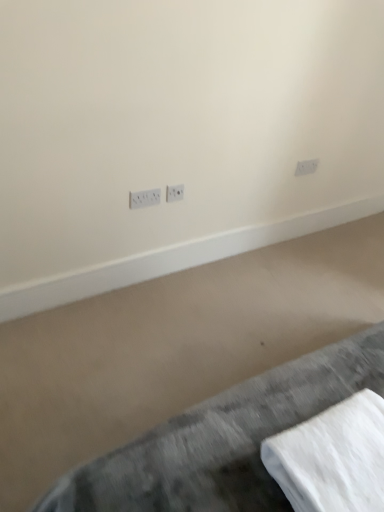
The image size is (384, 512). What do you see at coordinates (174, 193) in the screenshot?
I see `white plastic power plugs and sockets at center, which is counted as the second power plugs and sockets, starting from the back` at bounding box center [174, 193].

The image size is (384, 512). What are the coordinates of `white plastic power plugs and sockets at center, placed as the second power plugs and sockets when sorted from bottom to top` in the screenshot? It's located at (174, 193).

The height and width of the screenshot is (512, 384). What do you see at coordinates (144, 198) in the screenshot?
I see `white plastic power plugs and sockets at center, acting as the 3th power plugs and sockets starting from the top` at bounding box center [144, 198].

The height and width of the screenshot is (512, 384). Describe the element at coordinates (306, 167) in the screenshot. I see `white plastic power plugs and sockets at upper right, acting as the first power plugs and sockets starting from the back` at that location.

Where is `white plastic power plugs and sockets at center, the 2th power plugs and sockets when ordered from front to back`? Image resolution: width=384 pixels, height=512 pixels. white plastic power plugs and sockets at center, the 2th power plugs and sockets when ordered from front to back is located at coordinates (174, 193).

Which object is further away from the camera, white plastic power plugs and sockets at upper right, the third power plugs and sockets positioned from the bottom, or white plastic power plugs and sockets at center, the 2th power plugs and sockets when ordered from front to back?

white plastic power plugs and sockets at upper right, the third power plugs and sockets positioned from the bottom, is further away from the camera.

Looking at this image, is white plastic power plugs and sockets at upper right, positioned as the first power plugs and sockets in top-to-bottom order, to the right of white plastic power plugs and sockets at center, which ranks as the 2th power plugs and sockets in left-to-right order, from the viewer's perspective?

Indeed, white plastic power plugs and sockets at upper right, positioned as the first power plugs and sockets in top-to-bottom order, is positioned on the right side of white plastic power plugs and sockets at center, which ranks as the 2th power plugs and sockets in left-to-right order.

Are white plastic power plugs and sockets at upper right, the third power plugs and sockets positioned from the bottom, and white plastic power plugs and sockets at center, placed as the second power plugs and sockets when sorted from bottom to top, far apart?

No, white plastic power plugs and sockets at upper right, the third power plugs and sockets positioned from the bottom, is in close proximity to white plastic power plugs and sockets at center, placed as the second power plugs and sockets when sorted from bottom to top.

Considering the relative sizes of white plastic power plugs and sockets at upper right, which is counted as the first power plugs and sockets, starting from the right, and white plastic power plugs and sockets at center, which ranks as the 2th power plugs and sockets in left-to-right order, in the image provided, is white plastic power plugs and sockets at upper right, which is counted as the first power plugs and sockets, starting from the right, shorter than white plastic power plugs and sockets at center, which ranks as the 2th power plugs and sockets in left-to-right order,?

Yes, white plastic power plugs and sockets at upper right, which is counted as the first power plugs and sockets, starting from the right, is shorter than white plastic power plugs and sockets at center, which ranks as the 2th power plugs and sockets in left-to-right order.

In the scene shown: From a real-world perspective, relative to white cotton towel at lower right, is white plastic power plugs and sockets at center, which is counted as the 2th power plugs and sockets, starting from the top, vertically above or below?

In terms of real-world spatial position, white plastic power plugs and sockets at center, which is counted as the 2th power plugs and sockets, starting from the top, is below white cotton towel at lower right.

The width and height of the screenshot is (384, 512). Find the location of `linen below the white plastic power plugs and sockets at center, which ranks as the 2th power plugs and sockets in left-to-right order (from the image's perspective)`. linen below the white plastic power plugs and sockets at center, which ranks as the 2th power plugs and sockets in left-to-right order (from the image's perspective) is located at coordinates (332, 458).

Considering the positions of point (174, 198) and point (368, 437), is point (174, 198) closer or farther from the camera than point (368, 437)?

Point (174, 198) is positioned farther from the camera compared to point (368, 437).

From a real-world perspective, which object stands above the other?

From a 3D spatial view, white plastic power plugs and sockets at upper right, which is counted as the first power plugs and sockets, starting from the right, is above.

Consider the image. Would you say white plastic power plugs and sockets at upper right, acting as the first power plugs and sockets starting from the back, is to the left or to the right of white plastic power plugs and sockets at center, which appears as the 3th power plugs and sockets when viewed from the back, in the picture?

Clearly, white plastic power plugs and sockets at upper right, acting as the first power plugs and sockets starting from the back, is on the right of white plastic power plugs and sockets at center, which appears as the 3th power plugs and sockets when viewed from the back, in the image.

Considering the sizes of objects white plastic power plugs and sockets at upper right, which is counted as the first power plugs and sockets, starting from the right, and white plastic power plugs and sockets at center, which is the 3th power plugs and sockets in right-to-left order, in the image provided, who is taller, white plastic power plugs and sockets at upper right, which is counted as the first power plugs and sockets, starting from the right, or white plastic power plugs and sockets at center, which is the 3th power plugs and sockets in right-to-left order,?

Standing taller between the two is white plastic power plugs and sockets at center, which is the 3th power plugs and sockets in right-to-left order.

Which point is more forward, (215, 492) or (168, 194)?

The point (215, 492) is closer to the camera.

Is gray fabric bed at lower right taller than white plastic power plugs and sockets at center, the 2th power plugs and sockets when ordered from front to back?

Correct, gray fabric bed at lower right is much taller as white plastic power plugs and sockets at center, the 2th power plugs and sockets when ordered from front to back.

Is gray fabric bed at lower right not near white plastic power plugs and sockets at center, which is counted as the 2th power plugs and sockets, starting from the right?

Yes, gray fabric bed at lower right and white plastic power plugs and sockets at center, which is counted as the 2th power plugs and sockets, starting from the right, are located far from each other.

From the image's perspective, is white plastic power plugs and sockets at center, placed as the 1th power plugs and sockets when sorted from left to right, positioned above or below white plastic power plugs and sockets at upper right, positioned as the first power plugs and sockets in top-to-bottom order?

Based on their image positions, white plastic power plugs and sockets at center, placed as the 1th power plugs and sockets when sorted from left to right, is located beneath white plastic power plugs and sockets at upper right, positioned as the first power plugs and sockets in top-to-bottom order.

How different are the orientations of white plastic power plugs and sockets at center, placed as the 1th power plugs and sockets when sorted from left to right, and white plastic power plugs and sockets at upper right, positioned as the first power plugs and sockets in top-to-bottom order, in degrees?

The facing directions of white plastic power plugs and sockets at center, placed as the 1th power plugs and sockets when sorted from left to right, and white plastic power plugs and sockets at upper right, positioned as the first power plugs and sockets in top-to-bottom order, are 1.55 degrees apart.

In terms of size, does white plastic power plugs and sockets at center, marked as the 1th power plugs and sockets in a front-to-back arrangement, appear bigger or smaller than white plastic power plugs and sockets at upper right, positioned as the first power plugs and sockets in top-to-bottom order?

Clearly, white plastic power plugs and sockets at center, marked as the 1th power plugs and sockets in a front-to-back arrangement, is larger in size than white plastic power plugs and sockets at upper right, positioned as the first power plugs and sockets in top-to-bottom order.

Between white plastic power plugs and sockets at center, which appears as the 3th power plugs and sockets when viewed from the back, and white plastic power plugs and sockets at upper right, which is counted as the first power plugs and sockets, starting from the right, which one appears on the left side from the viewer's perspective?

white plastic power plugs and sockets at center, which appears as the 3th power plugs and sockets when viewed from the back.

Based on the photo, which of these two, white plastic power plugs and sockets at upper right, acting as the first power plugs and sockets starting from the back, or gray fabric bed at lower right, stands shorter?

white plastic power plugs and sockets at upper right, acting as the first power plugs and sockets starting from the back, is shorter.

Measure the distance from white plastic power plugs and sockets at upper right, the 3th power plugs and sockets from the left, to gray fabric bed at lower right.

The distance of white plastic power plugs and sockets at upper right, the 3th power plugs and sockets from the left, from gray fabric bed at lower right is 5.14 feet.

Is there a large distance between white plastic power plugs and sockets at upper right, positioned as the first power plugs and sockets in top-to-bottom order, and gray fabric bed at lower right?

Yes, white plastic power plugs and sockets at upper right, positioned as the first power plugs and sockets in top-to-bottom order, and gray fabric bed at lower right are located far from each other.

Would you say white plastic power plugs and sockets at upper right, which is counted as the first power plugs and sockets, starting from the right, is to the left or to the right of gray fabric bed at lower right in the picture?

Based on their positions, white plastic power plugs and sockets at upper right, which is counted as the first power plugs and sockets, starting from the right, is located to the right of gray fabric bed at lower right.

In order to click on furniture below the white plastic power plugs and sockets at upper right, placed as the third power plugs and sockets when sorted from front to back (from a real-world perspective) in this screenshot , I will do click(223, 440).

How distant is gray fabric bed at lower right from white plastic power plugs and sockets at upper right, the 3th power plugs and sockets from the left?

5.14 feet.

From a real-world perspective, is gray fabric bed at lower right above or below white plastic power plugs and sockets at upper right, the third power plugs and sockets positioned from the bottom?

gray fabric bed at lower right is situated lower than white plastic power plugs and sockets at upper right, the third power plugs and sockets positioned from the bottom, in the real world.

Between gray fabric bed at lower right and white plastic power plugs and sockets at upper right, the 3th power plugs and sockets from the left, which one has larger width?

gray fabric bed at lower right is wider.

You are a GUI agent. You are given a task and a screenshot of the screen. Output one action in this format:
    pyautogui.click(x=<x>, y=<y>)
    Task: Click on the 1st power plugs and sockets in front of the white plastic power plugs and sockets at upper right, which is counted as the first power plugs and sockets, starting from the right, starting your count from the anchor
    
    Given the screenshot: What is the action you would take?
    pyautogui.click(x=174, y=193)

Find the location of a particular element. Image resolution: width=384 pixels, height=512 pixels. the 1st power plugs and sockets counting from the left side of the white cotton towel at lower right is located at coordinates (174, 193).

Based on their spatial positions, is white plastic power plugs and sockets at upper right, the 3th power plugs and sockets from the left, or gray fabric bed at lower right further from white plastic power plugs and sockets at center, which is counted as the 2th power plugs and sockets, starting from the right?

gray fabric bed at lower right is positioned further to the anchor white plastic power plugs and sockets at center, which is counted as the 2th power plugs and sockets, starting from the right.

Based on the photo, based on their spatial positions, is white cotton towel at lower right or white plastic power plugs and sockets at center, which is counted as the second power plugs and sockets, starting from the back, further from gray fabric bed at lower right?

white plastic power plugs and sockets at center, which is counted as the second power plugs and sockets, starting from the back, is further to gray fabric bed at lower right.

From the image, which object appears to be nearer to white cotton towel at lower right, white plastic power plugs and sockets at center, which appears as the 3th power plugs and sockets when viewed from the back, or gray fabric bed at lower right?

gray fabric bed at lower right is positioned closer to the anchor white cotton towel at lower right.

When comparing their distances from white plastic power plugs and sockets at center, the 2th power plugs and sockets when ordered from front to back, does gray fabric bed at lower right or white plastic power plugs and sockets at upper right, positioned as the first power plugs and sockets in top-to-bottom order, seem further?

gray fabric bed at lower right is further to white plastic power plugs and sockets at center, the 2th power plugs and sockets when ordered from front to back.

When comparing their distances from white cotton towel at lower right, does white plastic power plugs and sockets at center, placed as the second power plugs and sockets when sorted from bottom to top, or white plastic power plugs and sockets at center, which is the 1th power plugs and sockets from bottom to top, seem further?

Based on the image, white plastic power plugs and sockets at center, placed as the second power plugs and sockets when sorted from bottom to top, appears to be further to white cotton towel at lower right.

Based on their spatial positions, is white cotton towel at lower right or white plastic power plugs and sockets at upper right, the third power plugs and sockets positioned from the bottom, closer to white plastic power plugs and sockets at center, which is the 1th power plugs and sockets from bottom to top?

white plastic power plugs and sockets at upper right, the third power plugs and sockets positioned from the bottom, lies closer to white plastic power plugs and sockets at center, which is the 1th power plugs and sockets from bottom to top, than the other object.

From the image, which object appears to be nearer to white plastic power plugs and sockets at center, the 2th power plugs and sockets when ordered from front to back, white plastic power plugs and sockets at center, acting as the 3th power plugs and sockets starting from the top, or white cotton towel at lower right?

white plastic power plugs and sockets at center, acting as the 3th power plugs and sockets starting from the top, is positioned closer to the anchor white plastic power plugs and sockets at center, the 2th power plugs and sockets when ordered from front to back.

Estimate the real-world distances between objects in this image. Which object is further from white plastic power plugs and sockets at center, which is counted as the second power plugs and sockets, starting from the back, gray fabric bed at lower right or white cotton towel at lower right?

white cotton towel at lower right is further to white plastic power plugs and sockets at center, which is counted as the second power plugs and sockets, starting from the back.

Where is `power plugs and sockets between white cotton towel at lower right and white plastic power plugs and sockets at center, which is counted as the 2th power plugs and sockets, starting from the right, from front to back`? The width and height of the screenshot is (384, 512). power plugs and sockets between white cotton towel at lower right and white plastic power plugs and sockets at center, which is counted as the 2th power plugs and sockets, starting from the right, from front to back is located at coordinates (144, 198).

In order to click on linen positioned between gray fabric bed at lower right and white plastic power plugs and sockets at center, acting as the 3th power plugs and sockets starting from the top, from near to far in this screenshot , I will do `click(332, 458)`.

Where is `linen between gray fabric bed at lower right and white plastic power plugs and sockets at upper right, the 3th power plugs and sockets from the left, from front to back`? linen between gray fabric bed at lower right and white plastic power plugs and sockets at upper right, the 3th power plugs and sockets from the left, from front to back is located at coordinates (332, 458).

Identify the location of power plugs and sockets situated between white plastic power plugs and sockets at center, marked as the 1th power plugs and sockets in a front-to-back arrangement, and white plastic power plugs and sockets at upper right, which is counted as the first power plugs and sockets, starting from the right, from left to right. (174, 193).